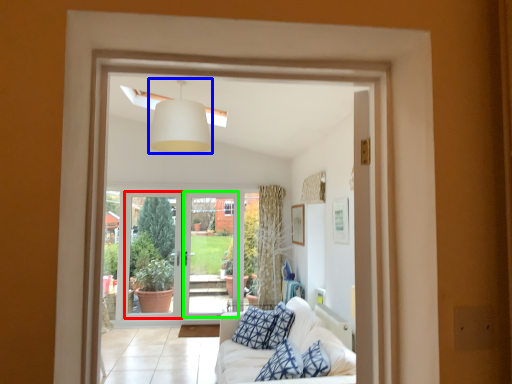
Question: Considering the real-world distances, which object is closest to screen door (highlighted by a red box)? light fixture (highlighted by a blue box) or screen door (highlighted by a green box).

Choices:
 (A) light fixture
 (B) screen door

Answer: (B)